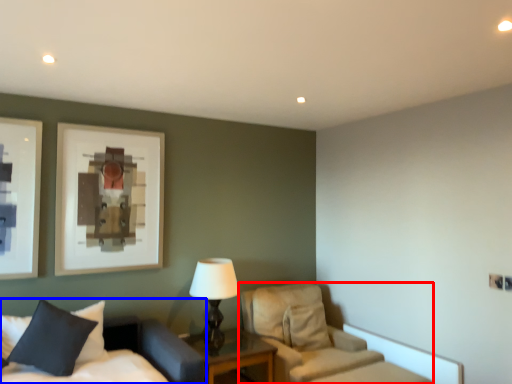
Question: Which object appears farthest to the camera in this image, chair (highlighted by a red box) or bed (highlighted by a blue box)?

Choices:
 (A) chair
 (B) bed

Answer: (A)